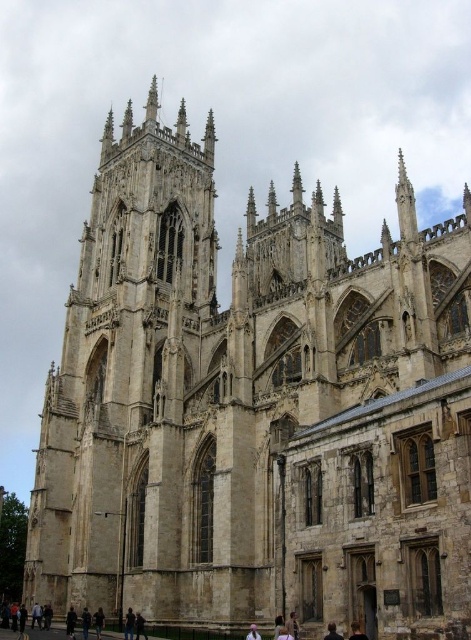
You are standing at the base of York Minster and want to take a photo of the point at coordinates point (x=357, y=632). If your camera has a maximum zoom range of 50 meters, will you be able to capture that point clearly?

The point at coordinates point (x=357, y=632) is 41.95 meters away from the viewer. Since the camera can zoom up to 50 meters, you will be able to capture it clearly.

Looking at this image, you are a tourist standing in front of York Minster and notice a dark blue fabric at lower center and a black hair at lower center. Which object is higher in the image?

The dark blue fabric at lower center is taller than the black hair at lower center.

You are a tourist standing in front of York Minster. You notice two items at the lower center of your view. What is the position of the black hair at lower center relative to the pink fabric at lower center?

The black hair at lower center is located above the pink fabric at lower center.